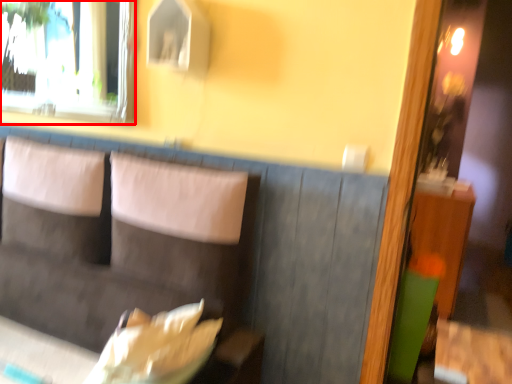
Question: Where is window (annotated by the red box) located in relation to couch in the image?

Choices:
 (A) left
 (B) right

Answer: (A)